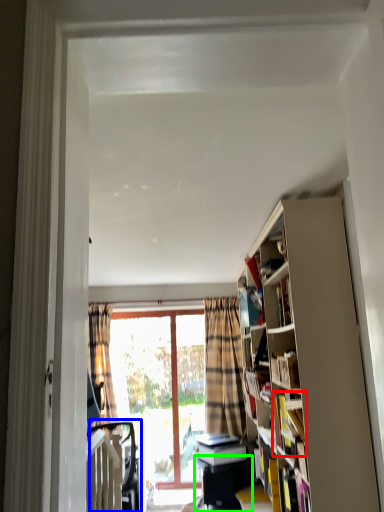
Question: Considering the real-world distances, which object is farthest from book (highlighted by a red box)? swivel chair (highlighted by a blue box) or table (highlighted by a green box)?

Choices:
 (A) swivel chair
 (B) table

Answer: (A)